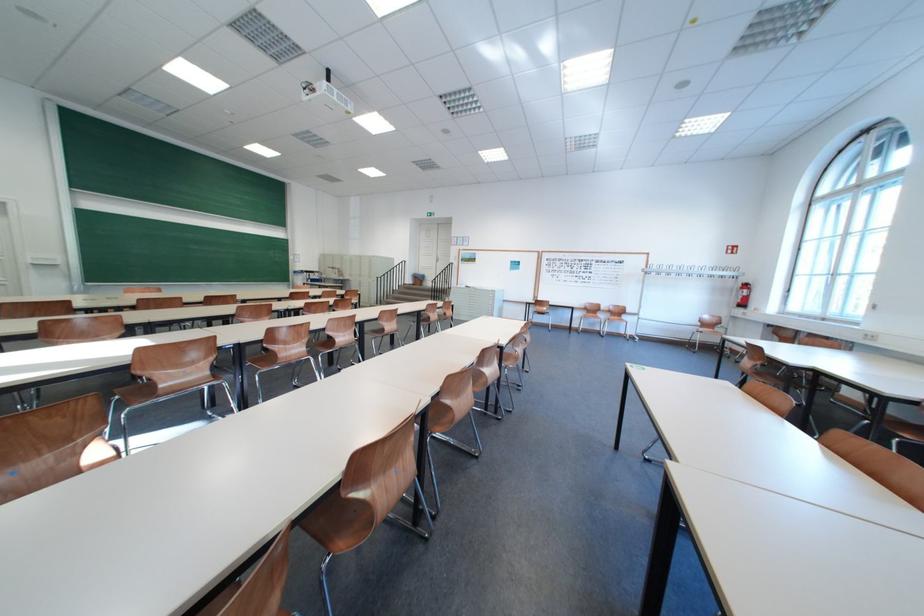
Find the location of a particular element. fire extinguisher handle is located at coordinates (744, 294).